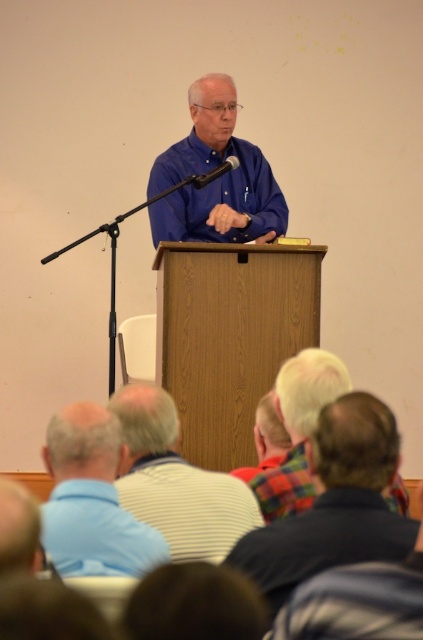
You are an event planner organizing a photo shoot for the event. You need to place a camera at the point with coordinates point (91, 500). What object will the camera be pointed at?

The point (91, 500) corresponds to the blue striped shirt at lower left, so the camera will be pointed at the blue striped shirt at lower left.

You are organizing a photo shoot and need to arrange the striped shirt at lower center and the blue striped shirt at lower left in a way that maintains their original sizes. If you want to place them side by side, which shirt should be placed on the left to ensure the larger one is on the viewer side?

The striped shirt at lower center should be placed on the left side because it is larger in size than the blue striped shirt at lower left, ensuring the larger one is on the viewer side.

You are a photographer standing at the camera position. You need to capture a closeup shot of the striped shirt at lower center. Given that your camera can focus on objects within 5 feet, will you be able to take the photo without moving closer?

The striped shirt at lower center is 6.32 feet away from the camera, which is beyond the 5 feet focusing range. Therefore, you cannot take the closeup shot without moving closer.